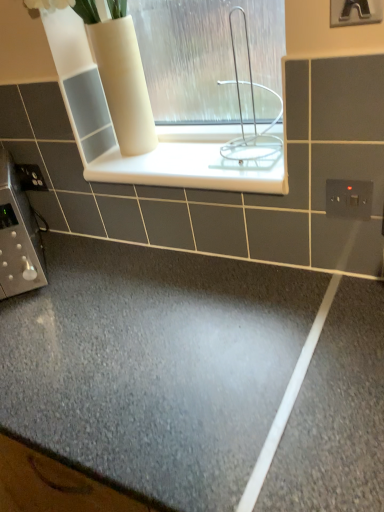
Question: Looking at their shapes, would you say white glossy ledge at center is wider or thinner than satin silver switch at lower left, the 2th electric outlet in the front-to-back sequence?

Choices:
 (A) thin
 (B) wide

Answer: (B)

Question: From a real-world perspective, is white glossy ledge at center positioned above or below satin silver switch at lower left, which ranks as the 2th electric outlet in bottom-to-top order?

Choices:
 (A) above
 (B) below

Answer: (A)

Question: Based on their relative distances, which object is nearer to the white glossy ledge at center?

Choices:
 (A) white plastic electric outlet at upper right, which ranks as the 2th electric outlet in left-to-right order
 (B) satin silver switch at lower left, which ranks as the 2th electric outlet in bottom-to-top order
 (C) white wire rack at center

Answer: (C)

Question: Estimate the real-world distances between objects in this image. Which object is closer to the white glossy ledge at center?

Choices:
 (A) white plastic electric outlet at upper right, which appears as the first electric outlet when ordered from the bottom
 (B) satin silver switch at lower left, the first electric outlet in the back-to-front sequence
 (C) white wire rack at center

Answer: (C)